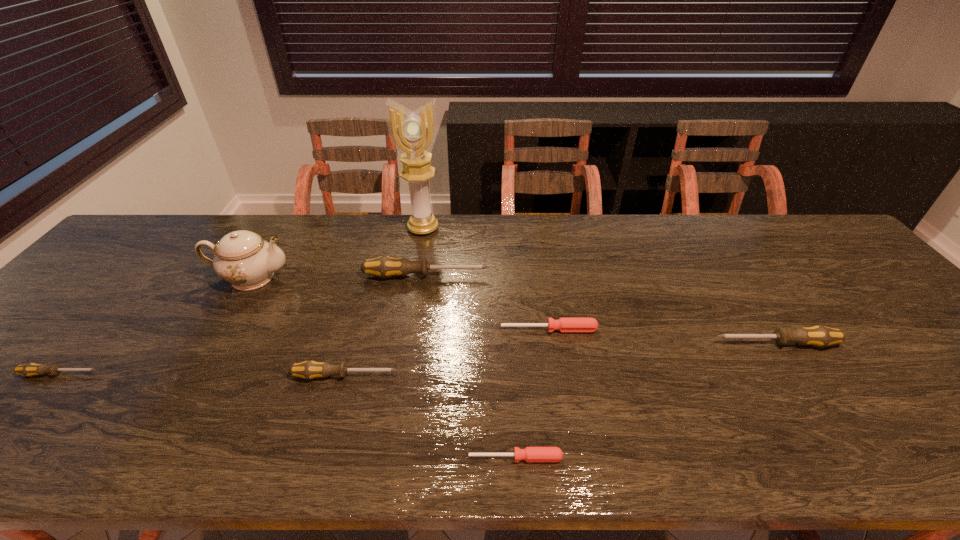
Where is `vacant region that satisfies the following two spatial constraints: 1. at the spout of the bigger red screwdriver; 2. on the left side of the seventh shortest object`? This screenshot has height=540, width=960. vacant region that satisfies the following two spatial constraints: 1. at the spout of the bigger red screwdriver; 2. on the left side of the seventh shortest object is located at coordinates (220, 329).

Locate an element on the screen. This screenshot has height=540, width=960. vacant space that satisfies the following two spatial constraints: 1. at the spout of the second farthest screwdriver; 2. on the right side of the second object from left to right is located at coordinates (220, 329).

This screenshot has height=540, width=960. What are the coordinates of `vacant point that satisfies the following two spatial constraints: 1. at the tip of the tallest screwdriver; 2. on the left side of the fifth nearest object` in the screenshot? It's located at (419, 329).